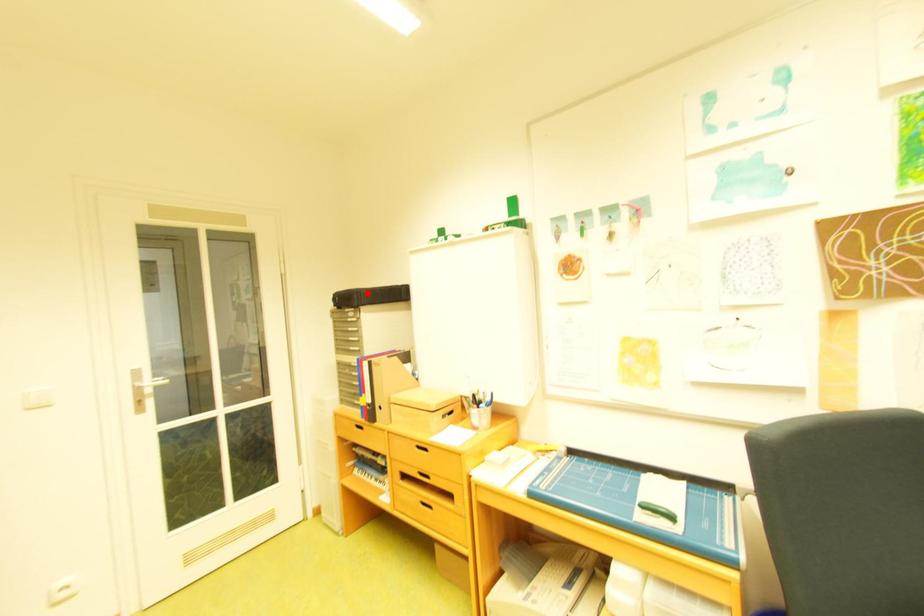
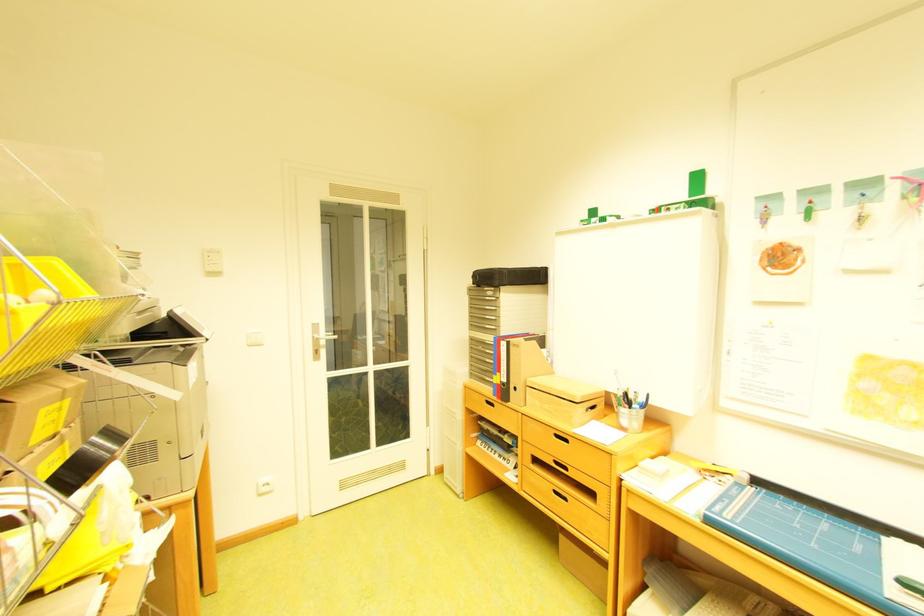
The point at the highlighted location is marked in the first image. Where is the corresponding point in the second image?

(511, 272)